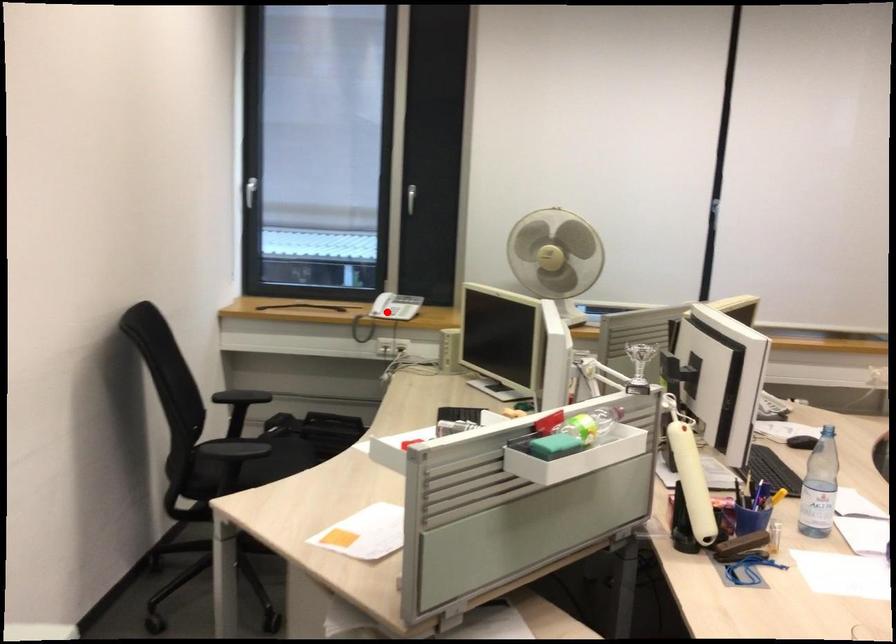
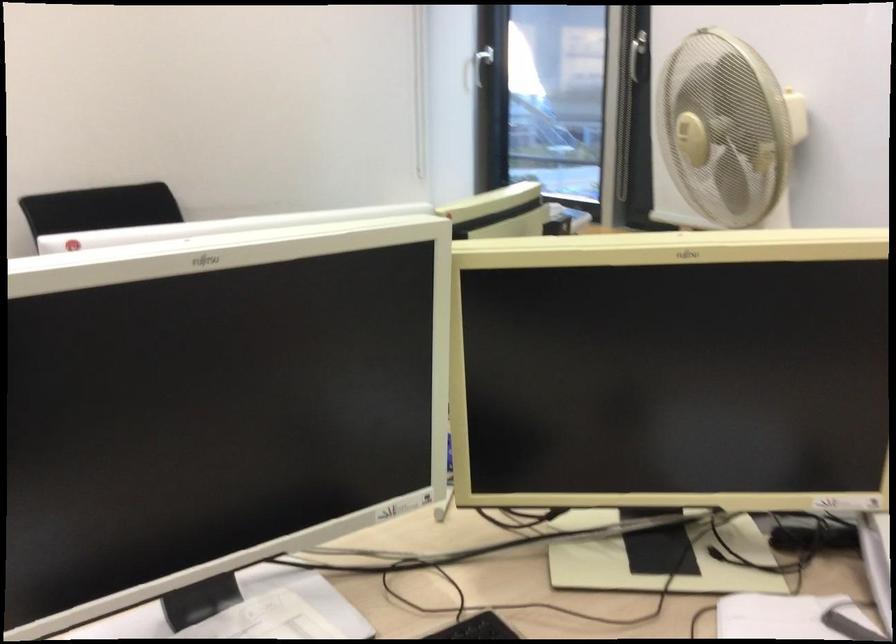
Question: I am providing you with two images of the same scene from different viewpoints. A red point is marked on the first image. Is the red point's position out of view in image 2?

Choices:
 (A) Yes
 (B) No

Answer: (A)